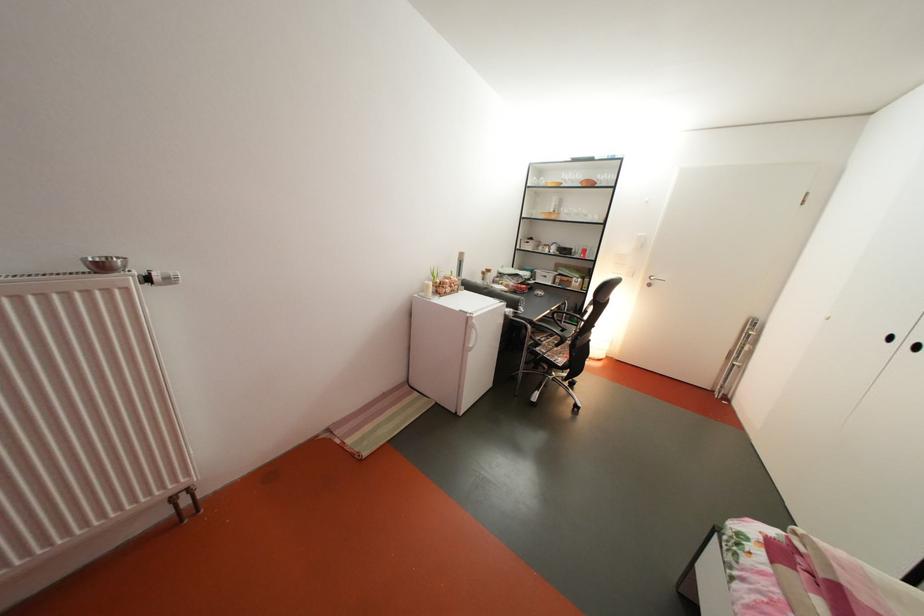
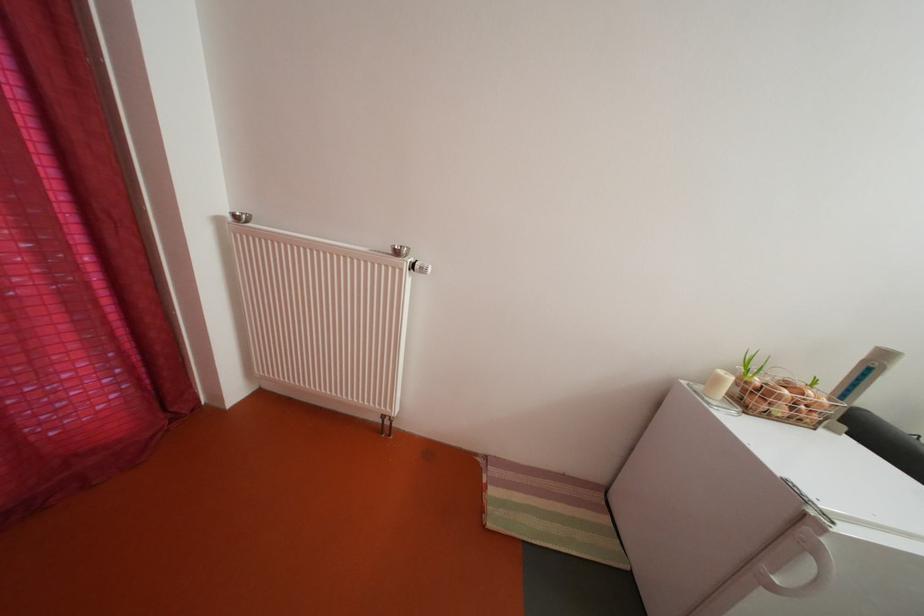
Where in the second image is the point corresponding to (x=459, y=296) from the first image?

(792, 416)